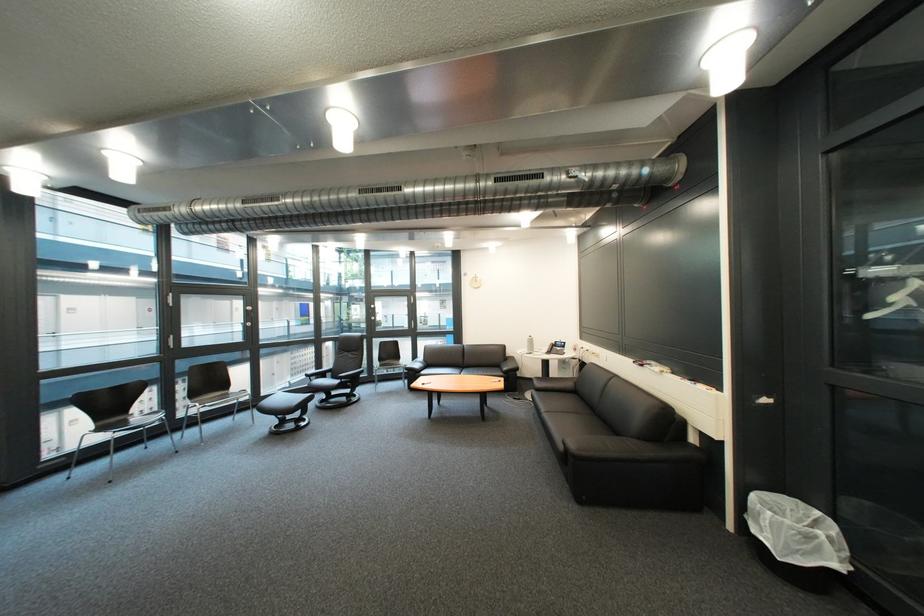
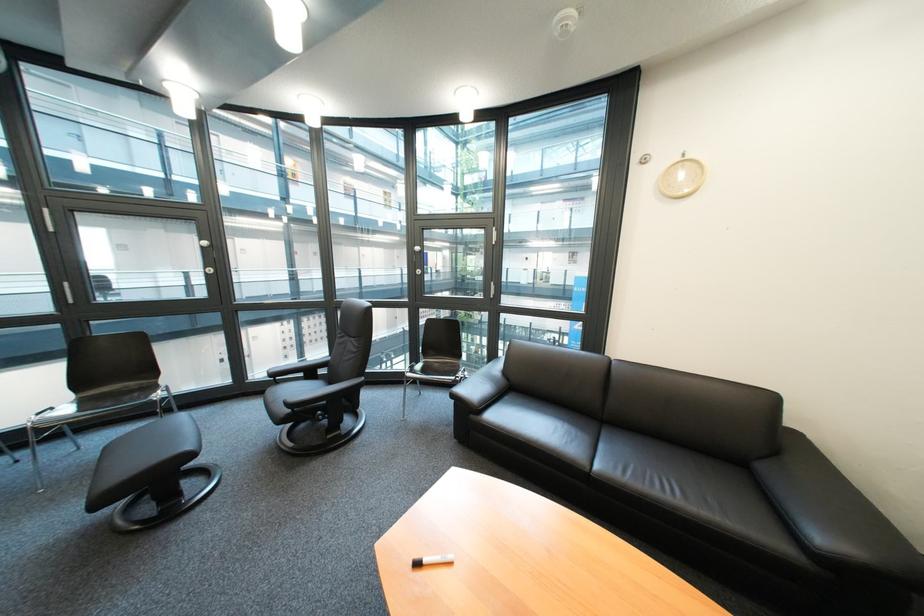
Question: I am providing you with two images of the same scene from different viewpoints. Which of the following objects are not visible in image2?

Choices:
 (A) sofa sitting surface
 (B) silver door handle
 (C) black footrest
 (D) none of these

Answer: (D)